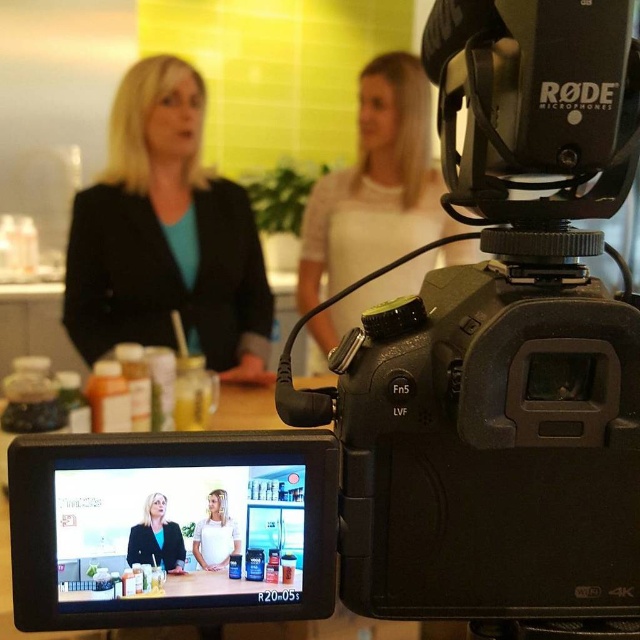
You are a camera operator adjusting the focus on the DSLR camera. You need to ensure both the matte black blazer at center and the white matte shirt at center are clearly visible in the frame. Which piece of clothing should you focus on first if you want to prioritize the person closer to the camera?

The matte black blazer at center is positioned on the left side of the white matte shirt at center, so focusing on the matte black blazer at center first would prioritize the person closer to the camera.

You are a camera operator adjusting the focus on the DSLR camera. You need to ensure both the black matte blazer at left and the white matte shirt at center are in focus. Which one should you focus on first to ensure proper depth of field?

You should focus on the black matte blazer at left first because it is closer to the camera, and adjusting focus starting from the nearest object ensures proper depth of field coverage for both subjects.